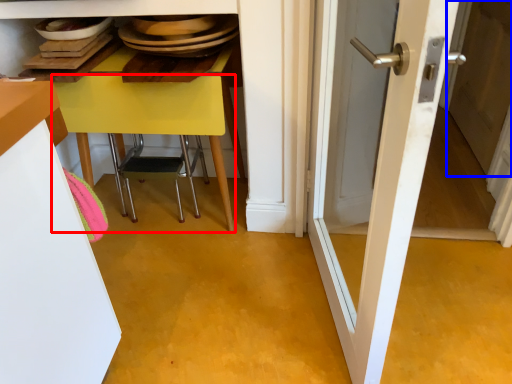
Question: Among these objects, which one is nearest to the camera, table (highlighted by a red box) or screen door (highlighted by a blue box)?

Choices:
 (A) table
 (B) screen door

Answer: (A)